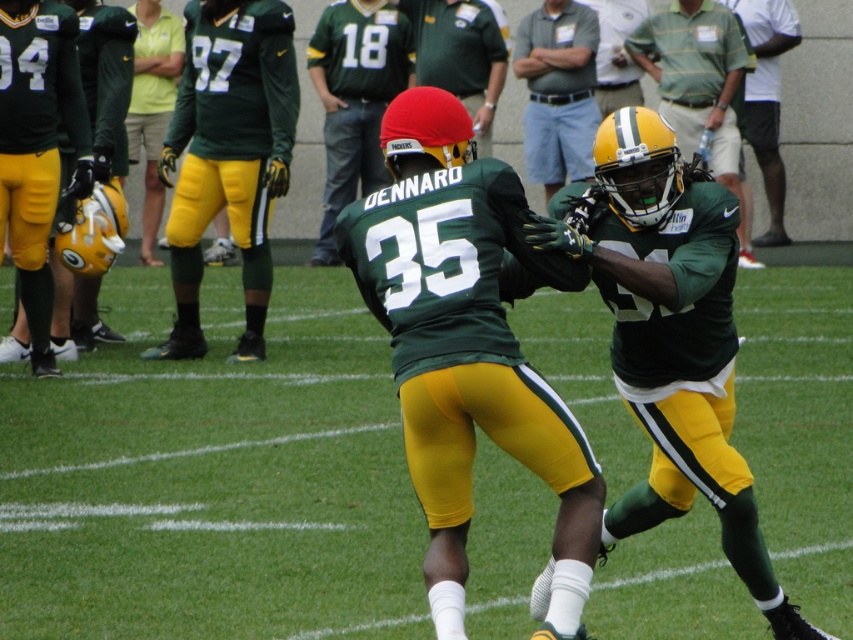
Question: Which of the following is the closest to the observer?

Choices:
 (A) (648, 337)
 (B) (653, 67)
 (C) (373, 563)
 (D) (437, 29)

Answer: (A)

Question: Which of the following is the closest to the observer?

Choices:
 (A) green/yellow turf at center
 (B) matte green helmet at upper right
 (C) green jersey at upper right

Answer: (A)

Question: Which object appears farthest from the camera in this image?

Choices:
 (A) matte green helmet at center
 (B) matte green jersey at center
 (C) matte green helmet at left

Answer: (A)

Question: Does matte green helmet at upper right appear on the left side of light blue cotton shirt at center?

Choices:
 (A) no
 (B) yes

Answer: (A)

Question: Can you confirm if matte green helmet at left is positioned below matte green helmet at center?

Choices:
 (A) no
 (B) yes

Answer: (B)

Question: Is matte green helmet at upper right closer to the viewer compared to green jersey at upper right?

Choices:
 (A) yes
 (B) no

Answer: (A)